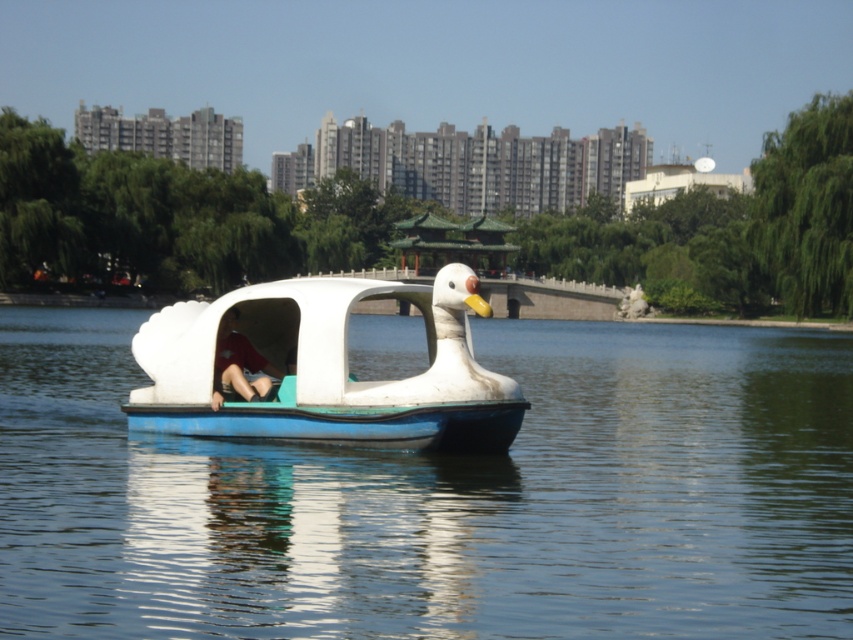
Question: Can you confirm if white matte duck boat at center is positioned above matte red shirt at center?

Choices:
 (A) no
 (B) yes

Answer: (B)

Question: Which object appears closest to the camera in this image?

Choices:
 (A) matte red shirt at center
 (B) transparent blue water at center

Answer: (B)

Question: Does white matte duck boat at center appear over matte red shirt at center?

Choices:
 (A) yes
 (B) no

Answer: (A)

Question: Is white matte duck boat at center further to camera compared to matte red shirt at center?

Choices:
 (A) yes
 (B) no

Answer: (B)

Question: Estimate the real-world distances between objects in this image. Which object is closer to the transparent blue water at center?

Choices:
 (A) white matte duck boat at center
 (B) matte red shirt at center

Answer: (A)

Question: Among these objects, which one is farthest from the camera?

Choices:
 (A) transparent blue water at center
 (B) white matte duck boat at center
 (C) matte red shirt at center

Answer: (C)